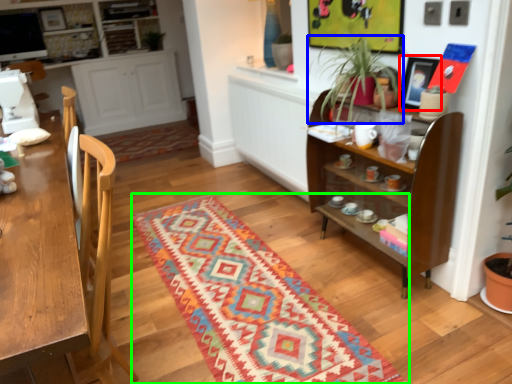
Question: Which object is positioned farthest from picture frame (highlighted by a red box)? Select from houseplant (highlighted by a blue box) and mat (highlighted by a green box).

Choices:
 (A) houseplant
 (B) mat

Answer: (B)